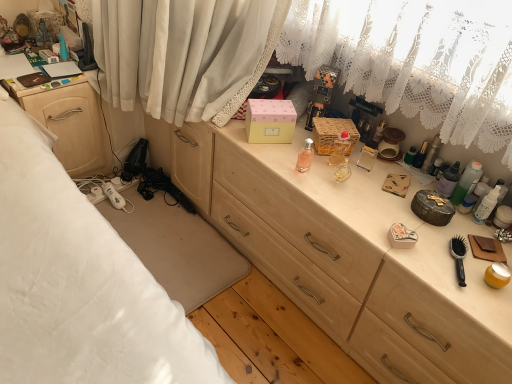
Where is `free location in front of pink glass perfume at center, marked as the 5th toiletry in a right-to-left arrangement`? The image size is (512, 384). free location in front of pink glass perfume at center, marked as the 5th toiletry in a right-to-left arrangement is located at coordinates (313, 189).